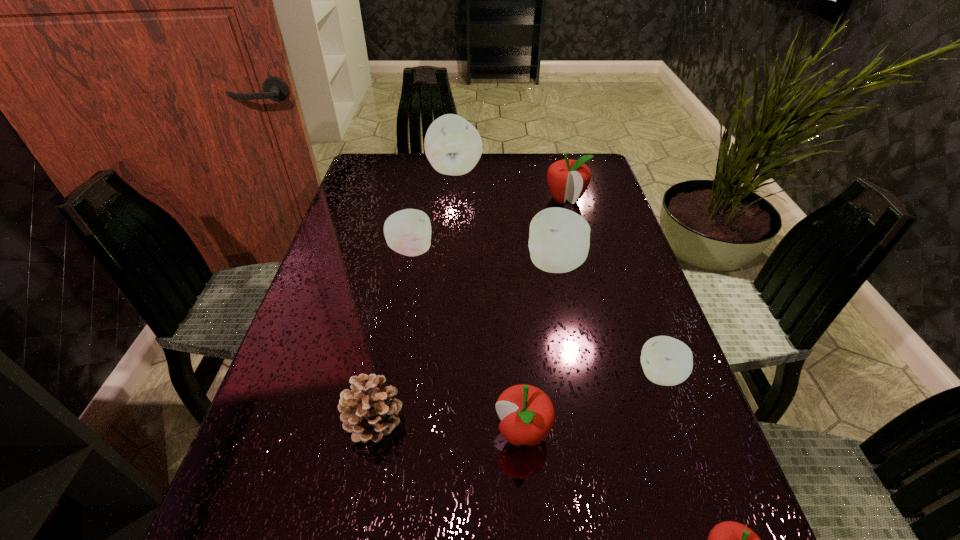
This screenshot has width=960, height=540. Find the location of `the rightmost white apple`. the rightmost white apple is located at coordinates (667, 361).

The image size is (960, 540). What are the coordinates of `vacant position located on the front of the farthest object` in the screenshot? It's located at (447, 257).

Find the location of a particular element. vacant space located 0.110m on the right of the second white apple from right to left is located at coordinates (629, 265).

Locate an element on the screen. Image resolution: width=960 pixels, height=540 pixels. vacant space located 0.280m on the front of the farthest red apple is located at coordinates (585, 278).

Where is `vacant space located on the back of the third biggest white apple`? The width and height of the screenshot is (960, 540). vacant space located on the back of the third biggest white apple is located at coordinates (417, 217).

The image size is (960, 540). Identify the location of vacant space located on the right of the second smallest red apple. (642, 433).

The image size is (960, 540). What are the coordinates of `free region located on the back of the pinecone` in the screenshot? It's located at (387, 355).

Locate an element on the screen. This screenshot has width=960, height=540. free point located on the back of the rightmost white apple is located at coordinates (631, 290).

This screenshot has width=960, height=540. Find the location of `apple that is at the left edge`. apple that is at the left edge is located at coordinates (408, 232).

Identify the location of pinecone that is at the left edge. The width and height of the screenshot is (960, 540). (368, 412).